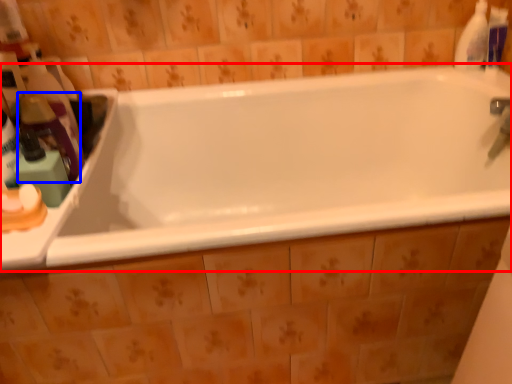
Question: Which object is further to the camera taking this photo, bathtub (highlighted by a red box) or cleaning product (highlighted by a blue box)?

Choices:
 (A) bathtub
 (B) cleaning product

Answer: (B)